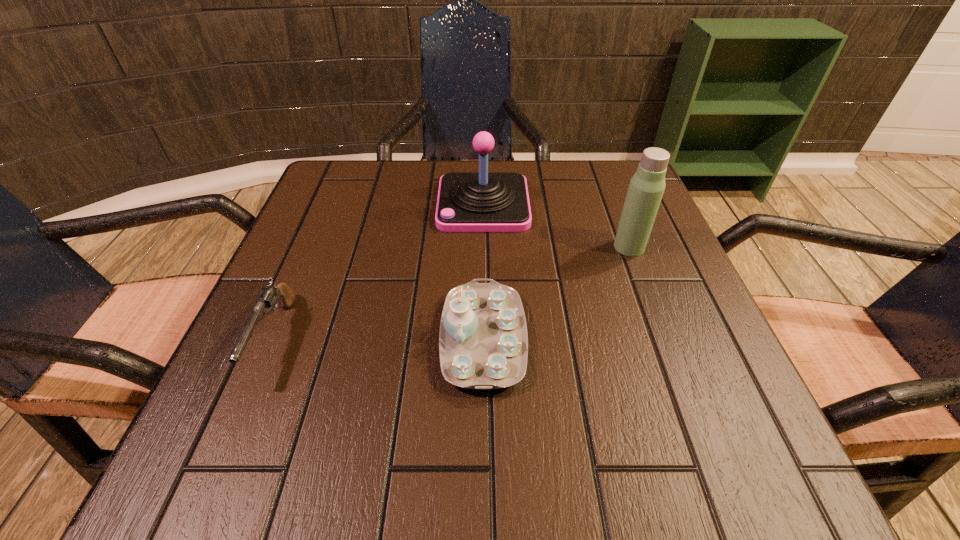
At what (x,y) coordinates should I click in order to perform the action: click on free spot at the near left corner of the desktop. Please return your answer as a coordinate pair (x, y). Looking at the image, I should click on (209, 480).

This screenshot has height=540, width=960. I want to click on free region at the far right corner, so click(610, 172).

Where is `vacant point located between the gun and the chinaware`? Image resolution: width=960 pixels, height=540 pixels. vacant point located between the gun and the chinaware is located at coordinates (379, 339).

I want to click on vacant region between the chinaware and the third shortest object, so tap(483, 272).

Find the location of `empty space between the chinaware and the leftmost object`. empty space between the chinaware and the leftmost object is located at coordinates (379, 339).

The width and height of the screenshot is (960, 540). Find the location of `free spot between the farthest object and the leftmost object`. free spot between the farthest object and the leftmost object is located at coordinates (379, 271).

Where is `vacant space in between the tallest object and the chinaware`? vacant space in between the tallest object and the chinaware is located at coordinates (556, 293).

Where is `free space between the farthest object and the leftmost object`? free space between the farthest object and the leftmost object is located at coordinates (379, 271).

Find the location of a particular element. This screenshot has width=960, height=540. free space between the chinaware and the farthest object is located at coordinates (483, 272).

Where is `free area in between the second tallest object and the gun`? The image size is (960, 540). free area in between the second tallest object and the gun is located at coordinates (379, 271).